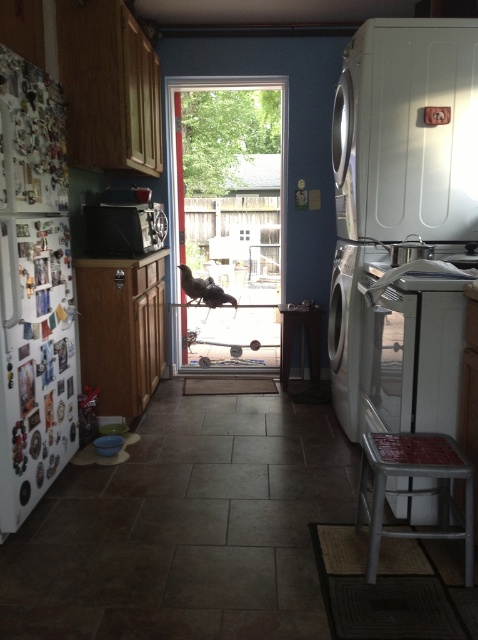
Can you confirm if white matte washing machine at right is positioned above clear glass screen door at center?

Incorrect, white matte washing machine at right is not positioned above clear glass screen door at center.

Which is behind, point (423, 124) or point (184, 104)?

The point (184, 104) is more distant.

Measure the distance between white matte washing machine at right and camera.

They are 8.56 feet apart.

The width and height of the screenshot is (478, 640). Find the location of `white matte washing machine at right`. white matte washing machine at right is located at coordinates (408, 131).

Who is higher up, white matte washing machine at right or metallic silver microwave at center?

white matte washing machine at right is higher up.

The height and width of the screenshot is (640, 478). What do you see at coordinates (408, 131) in the screenshot?
I see `white matte washing machine at right` at bounding box center [408, 131].

You are a GUI agent. You are given a task and a screenshot of the screen. Output one action in this format:
    pyautogui.click(x=<x>, y=<y>)
    Task: Click on the white matte washing machine at right
    This screenshot has height=640, width=478.
    Given the screenshot: What is the action you would take?
    pyautogui.click(x=408, y=131)

Is clear glass screen door at center thinner than metallic silver stool at lower right?

No, clear glass screen door at center is not thinner than metallic silver stool at lower right.

Between clear glass screen door at center and metallic silver stool at lower right, which one appears on the right side from the viewer's perspective?

metallic silver stool at lower right

Locate an element on the screen. Image resolution: width=478 pixels, height=640 pixels. clear glass screen door at center is located at coordinates pyautogui.click(x=228, y=218).